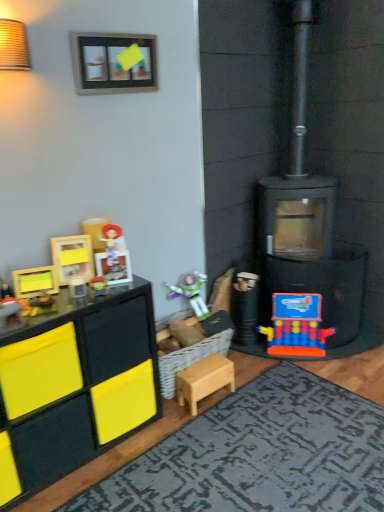
The height and width of the screenshot is (512, 384). Find the location of `vacant area that lies to the right of light wood stool at center, which is the 4th toy from left to right`. vacant area that lies to the right of light wood stool at center, which is the 4th toy from left to right is located at coordinates (253, 397).